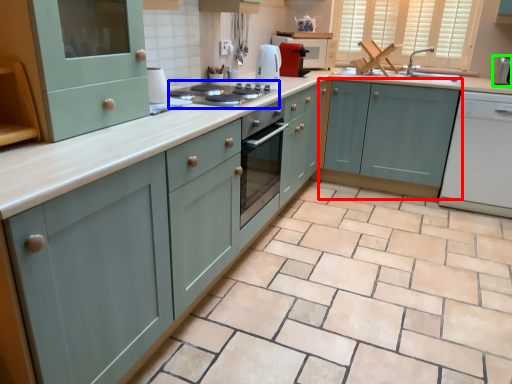
Question: Which is farther away from cabinetry (highlighted by a red box)? kitchen appliance (highlighted by a blue box) or appliance (highlighted by a green box)?

Choices:
 (A) kitchen appliance
 (B) appliance

Answer: (A)